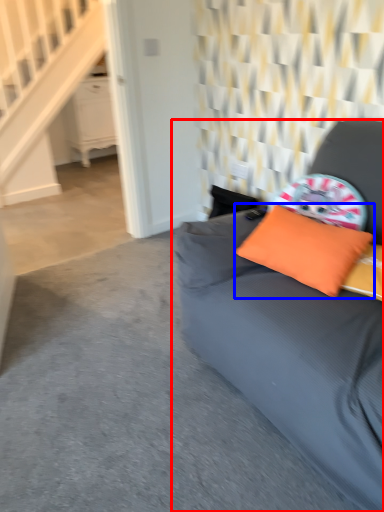
Question: Which point is closer to the camera, studio couch (highlighted by a red box) or pillow (highlighted by a blue box)?

Choices:
 (A) studio couch
 (B) pillow

Answer: (A)